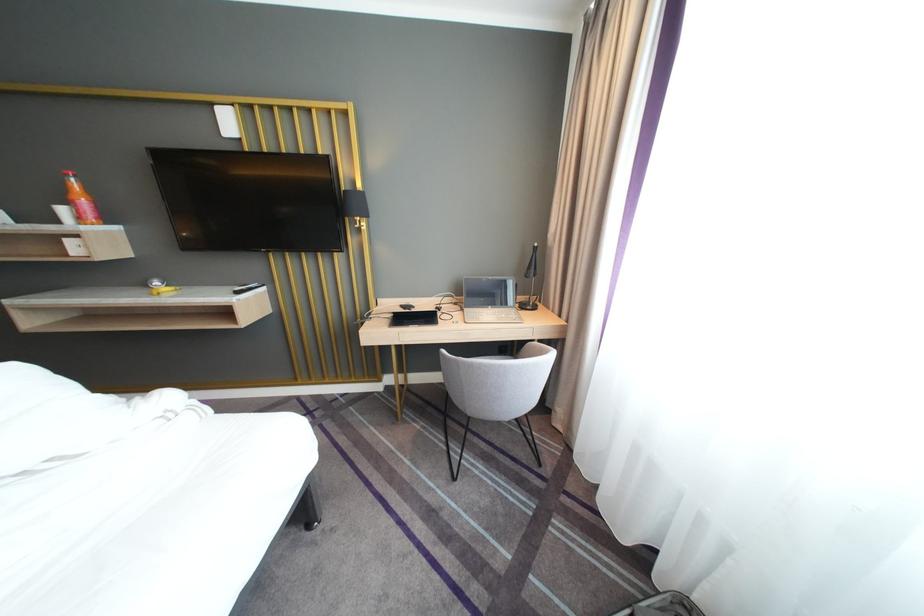
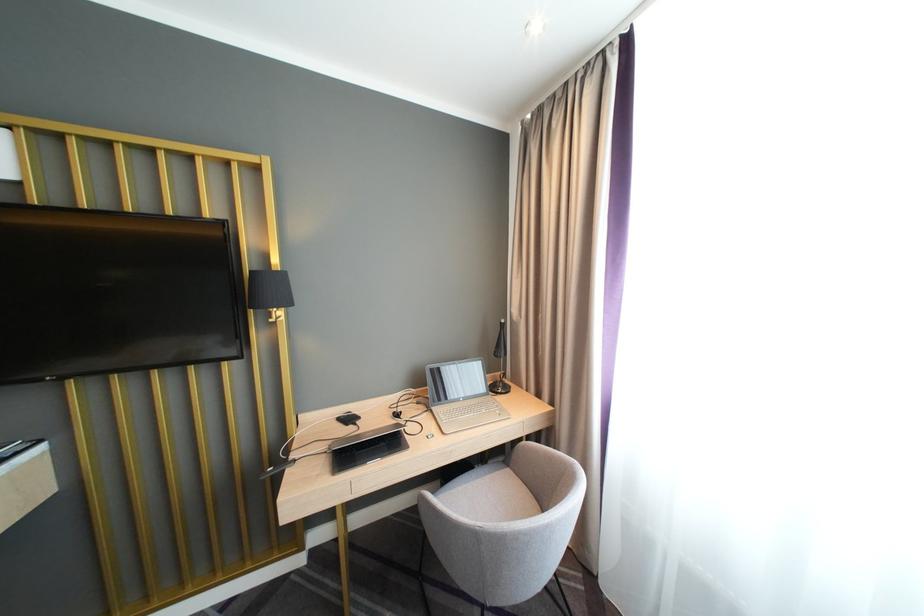
Where in the second image is the point corresponding to the point at 535,307 from the first image?

(505, 390)